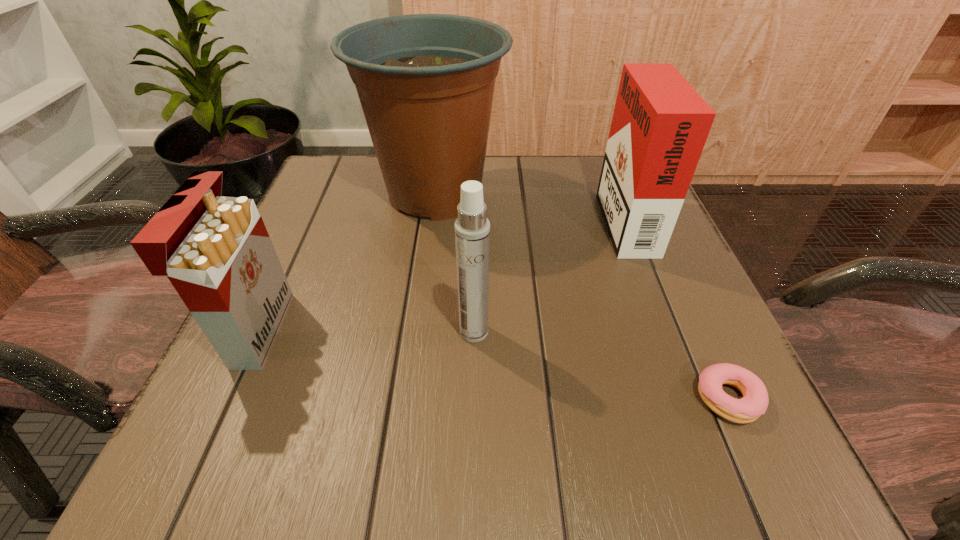
The height and width of the screenshot is (540, 960). I want to click on free space that is in between the flowerpot and the doughnut, so click(x=581, y=296).

Find the location of `the closest object to the flowerpot`. the closest object to the flowerpot is located at coordinates (215, 250).

The width and height of the screenshot is (960, 540). What are the coordinates of `the closest object to the flowerpot` in the screenshot? It's located at (215, 250).

You are a GUI agent. You are given a task and a screenshot of the screen. Output one action in this format:
    pyautogui.click(x=<x>, y=<y>)
    Task: Click on the vacant point that satisfies the following two spatial constraints: 1. on the front side of the flowerpot; 2. with the lid open on the shorter cigarette case
    
    Given the screenshot: What is the action you would take?
    pyautogui.click(x=418, y=330)

Identify the location of vacant area in the image that satisfies the following two spatial constraints: 1. on the front-facing side of the right cigarette case; 2. on the right side of the nearest object. The height and width of the screenshot is (540, 960). (695, 398).

Image resolution: width=960 pixels, height=540 pixels. Find the location of `free space in the image that satisfies the following two spatial constraints: 1. with the lid open on the left cigarette case; 2. on the left side of the aerosol can`. free space in the image that satisfies the following two spatial constraints: 1. with the lid open on the left cigarette case; 2. on the left side of the aerosol can is located at coordinates (x=257, y=332).

Where is `free space that satisfies the following two spatial constraints: 1. on the front-facing side of the nearest object; 2. on the left side of the right cigarette case`? The height and width of the screenshot is (540, 960). free space that satisfies the following two spatial constraints: 1. on the front-facing side of the nearest object; 2. on the left side of the right cigarette case is located at coordinates (695, 398).

You are a GUI agent. You are given a task and a screenshot of the screen. Output one action in this format:
    pyautogui.click(x=<x>, y=<y>)
    Task: Click on the free space in the image that satisfies the following two spatial constraints: 1. on the front side of the aerosol can; 2. on the right side of the flowerpot
    
    Given the screenshot: What is the action you would take?
    pyautogui.click(x=418, y=332)

The height and width of the screenshot is (540, 960). I want to click on free region that satisfies the following two spatial constraints: 1. on the front-facing side of the right cigarette case; 2. on the back side of the shortest object, so click(x=695, y=398).

Image resolution: width=960 pixels, height=540 pixels. What are the coordinates of `vacant region that satisfies the following two spatial constraints: 1. on the back side of the nearest object; 2. on the front-facing side of the farther cigarette case` in the screenshot? It's located at (645, 217).